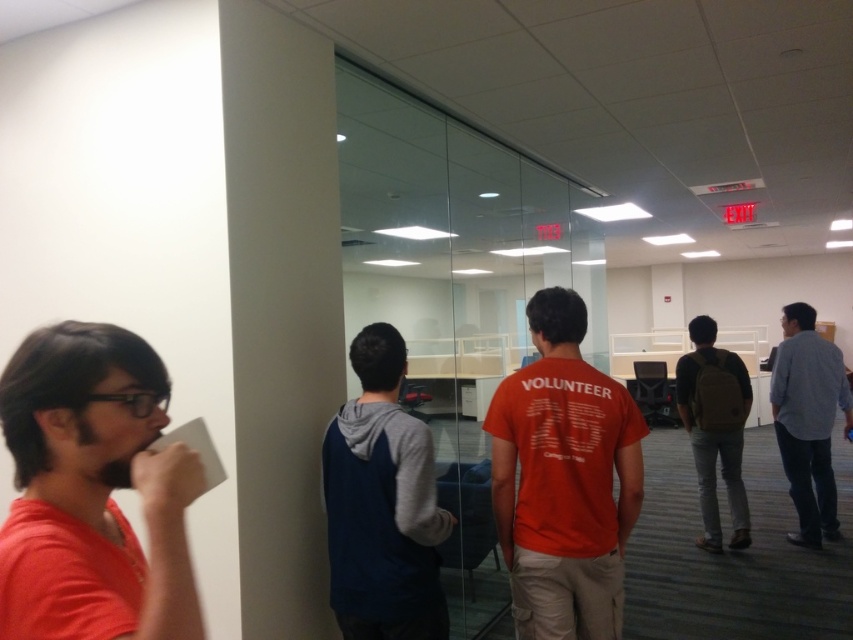
What do you see at coordinates (563, 480) in the screenshot? I see `orange cotton t-shirt at center` at bounding box center [563, 480].

Does orange cotton t-shirt at center have a lesser width compared to dark blue hoodie at center?

No.

Which is behind, point (511, 538) or point (387, 516)?

Point (511, 538)

Where is `orange cotton t-shirt at center`? Image resolution: width=853 pixels, height=640 pixels. orange cotton t-shirt at center is located at coordinates pos(563,480).

Looking at this image, can you confirm if orange cotton t-shirt at center is wider than brown leather backpack at center-right?

Incorrect, orange cotton t-shirt at center's width does not surpass brown leather backpack at center-right's.

Which is more to the left, orange cotton t-shirt at center or brown leather backpack at center-right?

orange cotton t-shirt at center

Does point (544, 348) come closer to viewer compared to point (721, 396)?

Yes.

The width and height of the screenshot is (853, 640). Identify the location of orange cotton t-shirt at center. [563, 480].

Does orange matte t-shirt at left appear over dark blue hoodie at center?

Indeed, orange matte t-shirt at left is positioned over dark blue hoodie at center.

Between orange matte t-shirt at left and dark blue hoodie at center, which one has more height?

dark blue hoodie at center

Describe the element at coordinates (96, 486) in the screenshot. I see `orange matte t-shirt at left` at that location.

Identify the location of orange matte t-shirt at left. click(x=96, y=486).